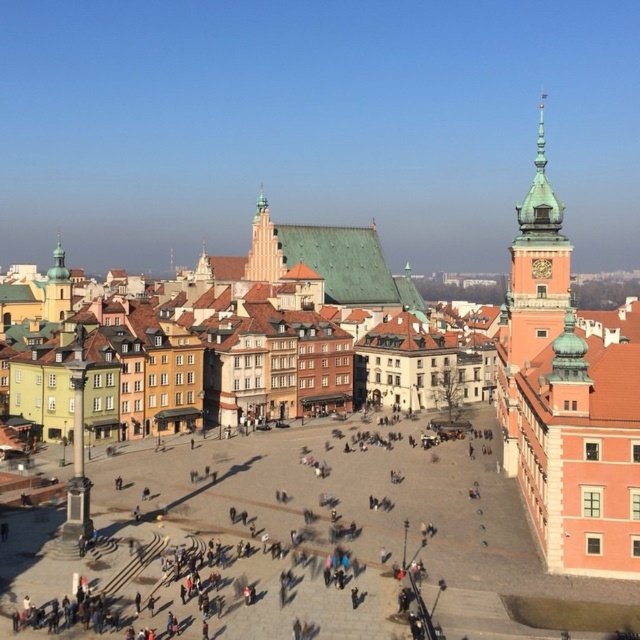
Who is taller, green matte tower at upper right or light beige stone tower at center?

Standing taller between the two is green matte tower at upper right.

Who is more forward, (522, 300) or (273, 280)?

Point (522, 300) is in front.

Is point (566, 266) less distant than point (253, 240)?

Yes, point (566, 266) is closer to viewer.

Where is `green matte tower at upper right`? green matte tower at upper right is located at coordinates (536, 268).